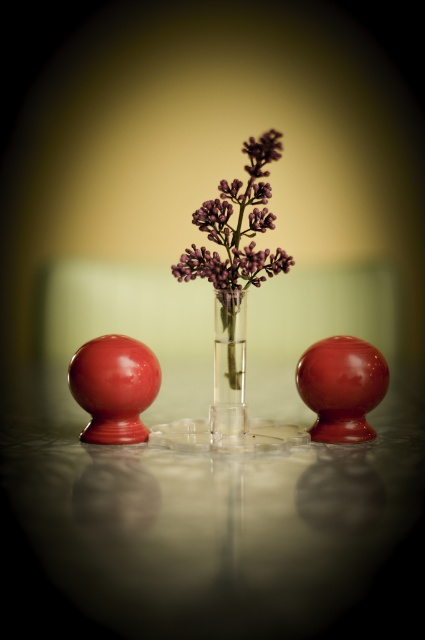
Between transparent glass table at center and purple matte flower at center, which one appears on the left side from the viewer's perspective?

transparent glass table at center is more to the left.

Does transparent glass table at center have a lesser width compared to purple matte flower at center?

In fact, transparent glass table at center might be wider than purple matte flower at center.

What do you see at coordinates (210, 536) in the screenshot?
I see `transparent glass table at center` at bounding box center [210, 536].

Image resolution: width=425 pixels, height=640 pixels. I want to click on transparent glass table at center, so click(210, 536).

What do you see at coordinates (237, 227) in the screenshot?
I see `purple matte flower at center` at bounding box center [237, 227].

From the picture: Which is more to the right, purple matte flower at center or clear glass vase at center?

purple matte flower at center

Is point (269, 259) farther from camera compared to point (232, 307)?

That is False.

In order to click on purple matte flower at center in this screenshot , I will do `click(237, 227)`.

Between point (254, 483) and point (244, 321), which one is positioned in front?

Positioned in front is point (254, 483).

Looking at this image, between transparent glass table at center and clear glass vase at center, which one is positioned higher?

clear glass vase at center is higher up.

Is point (303, 548) positioned behind point (224, 296)?

No, (303, 548) is closer to viewer.

The width and height of the screenshot is (425, 640). Find the location of `transparent glass table at center`. transparent glass table at center is located at coordinates (210, 536).